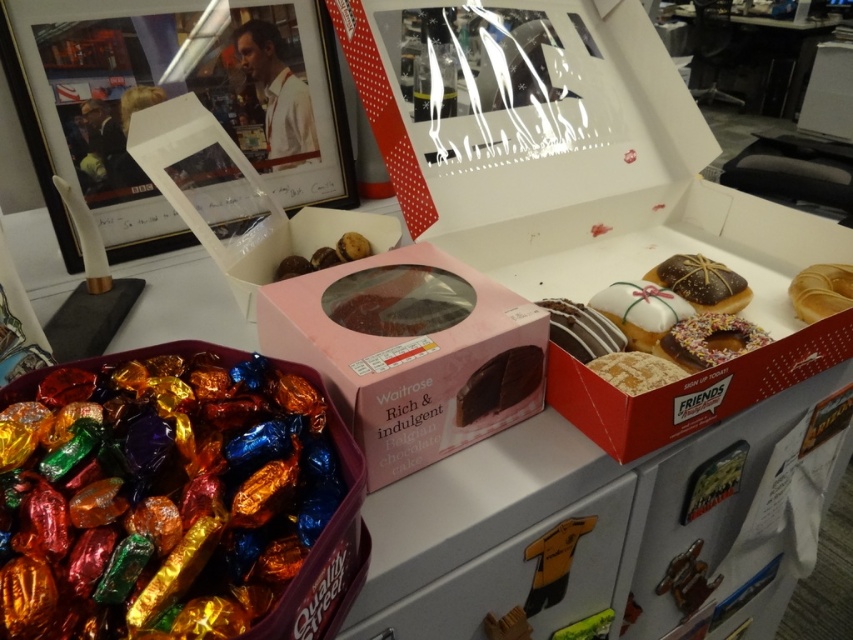
Is point (227, 570) behind point (839, 300)?

No.

Can you confirm if metallic foil wrapped chocolates at lower left is positioned to the left of glazed donut at right?

Correct, you'll find metallic foil wrapped chocolates at lower left to the left of glazed donut at right.

Locate an element on the screen. Image resolution: width=853 pixels, height=640 pixels. metallic foil wrapped chocolates at lower left is located at coordinates (178, 499).

Is metallic foil wrapped chocolates at lower left below dark chocolate cake at center?

Yes.

Identify the location of metallic foil wrapped chocolates at lower left. This screenshot has width=853, height=640. (178, 499).

Does metallic silver drawer at lower center have a greater width compared to sprinkled chocolate donut at center?

Correct, the width of metallic silver drawer at lower center exceeds that of sprinkled chocolate donut at center.

At what (x,y) coordinates should I click in order to perform the action: click on metallic silver drawer at lower center. Please return your answer as a coordinate pair (x, y). This screenshot has height=640, width=853. Looking at the image, I should click on (521, 577).

This screenshot has height=640, width=853. Identify the location of metallic silver drawer at lower center. (521, 577).